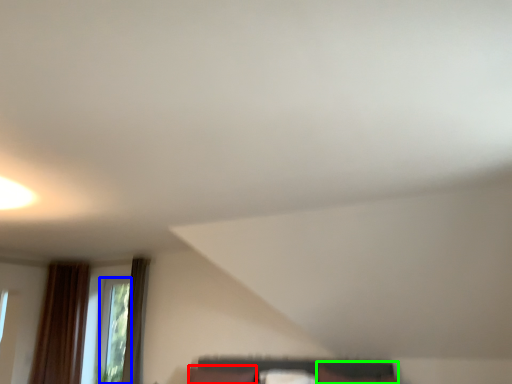
Question: Which is farther away from pillow (highlighted by a red box)? window (highlighted by a blue box) or furniture (highlighted by a green box)?

Choices:
 (A) window
 (B) furniture

Answer: (A)